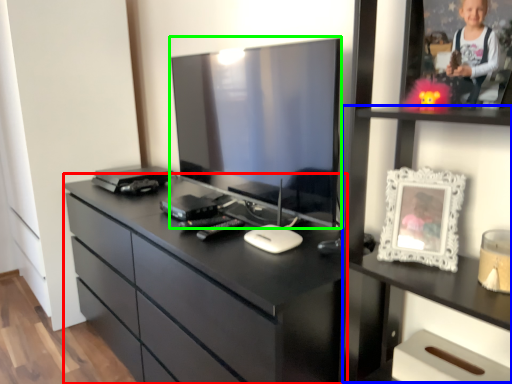
Question: Which is nearer to the chest of drawers (highlighted by a red box)? tv cabinet (highlighted by a blue box) or television (highlighted by a green box).

Choices:
 (A) tv cabinet
 (B) television

Answer: (B)